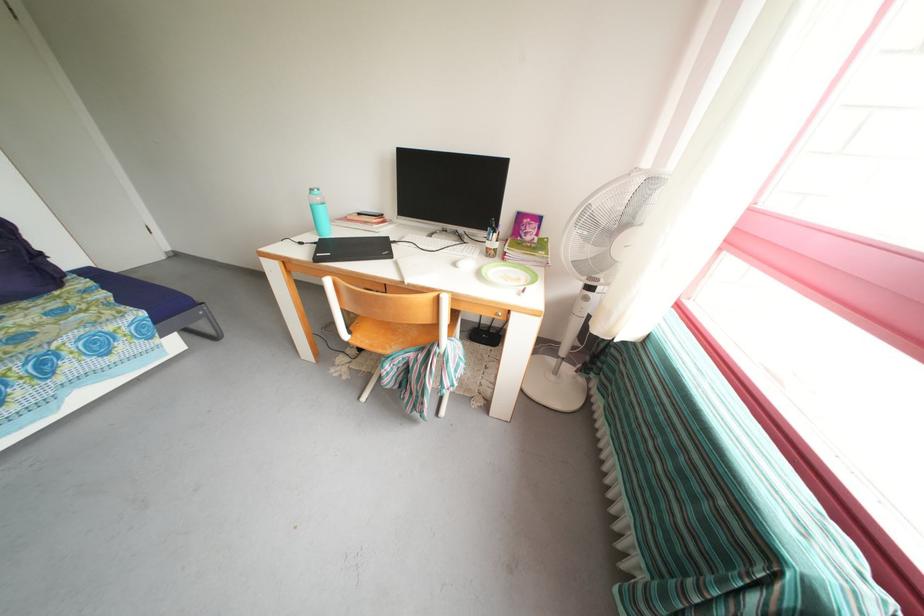
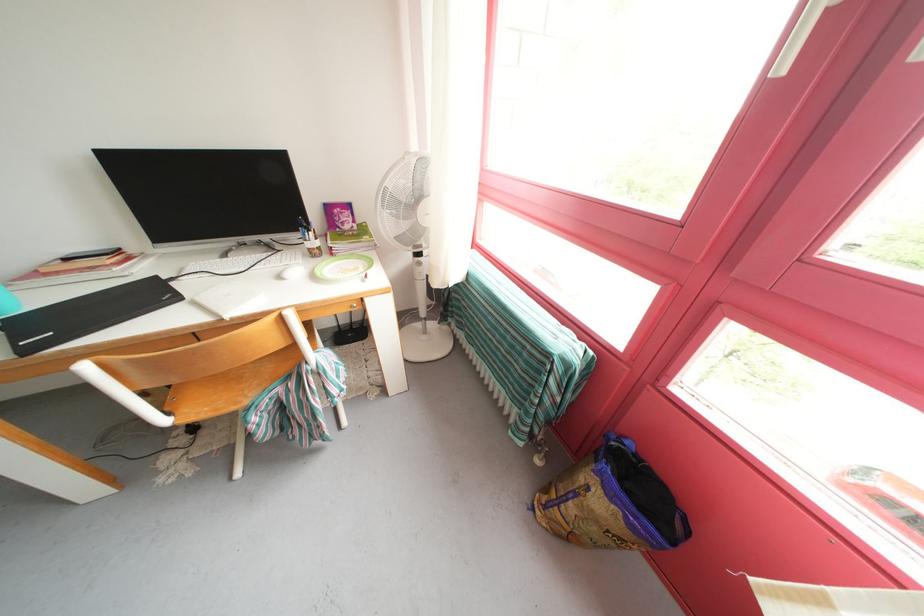
Find the pixel in the second image that matches point 502,238 in the first image.

(315, 236)